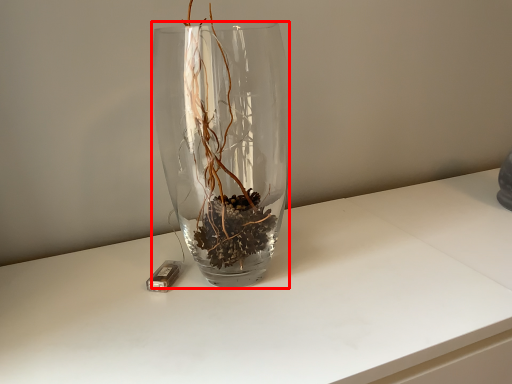
Question: In this image, where is vase (annotated by the red box) located relative to candle holder?

Choices:
 (A) left
 (B) right

Answer: (B)